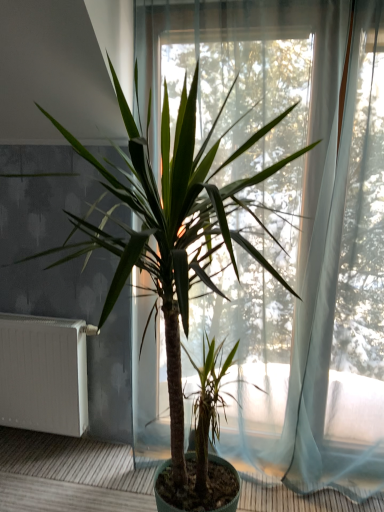
Question: Considering the positions of white matte radiator at left and transparent curtain at center in the image, is white matte radiator at left taller or shorter than transparent curtain at center?

Choices:
 (A) short
 (B) tall

Answer: (A)

Question: Considering the positions of point (36, 349) and point (144, 347), is point (36, 349) closer or farther from the camera than point (144, 347)?

Choices:
 (A) farther
 (B) closer

Answer: (A)

Question: Do you think white matte radiator at left is within transparent curtain at center, or outside of it?

Choices:
 (A) inside
 (B) outside

Answer: (B)

Question: Considering the positions of transparent curtain at center and white matte radiator at left in the image, is transparent curtain at center taller or shorter than white matte radiator at left?

Choices:
 (A) short
 (B) tall

Answer: (B)

Question: Would you say transparent curtain at center is to the left or to the right of white matte radiator at left in the picture?

Choices:
 (A) right
 (B) left

Answer: (A)

Question: From the image's perspective, is transparent curtain at center positioned above or below white matte radiator at left?

Choices:
 (A) above
 (B) below

Answer: (A)

Question: Based on their sizes in the image, would you say transparent curtain at center is bigger or smaller than white matte radiator at left?

Choices:
 (A) big
 (B) small

Answer: (A)